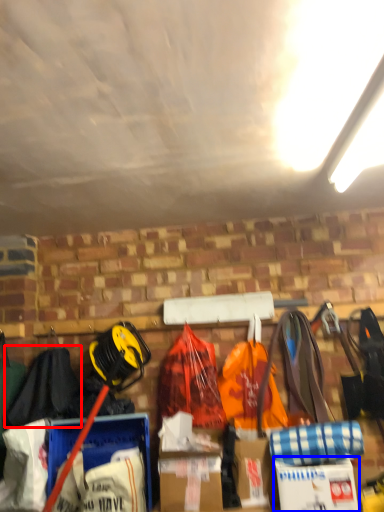
Question: Which of the following is the closest to the observer, clothing (highlighted by a red box) or cardboard box (highlighted by a blue box)?

Choices:
 (A) clothing
 (B) cardboard box

Answer: (B)